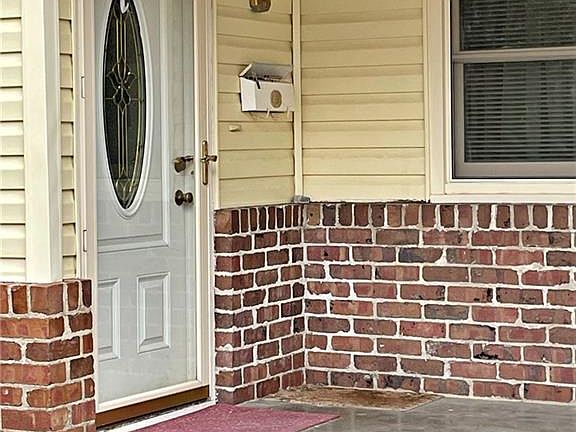
Locate an element on the screen. The width and height of the screenshot is (576, 432). locks is located at coordinates (185, 164).